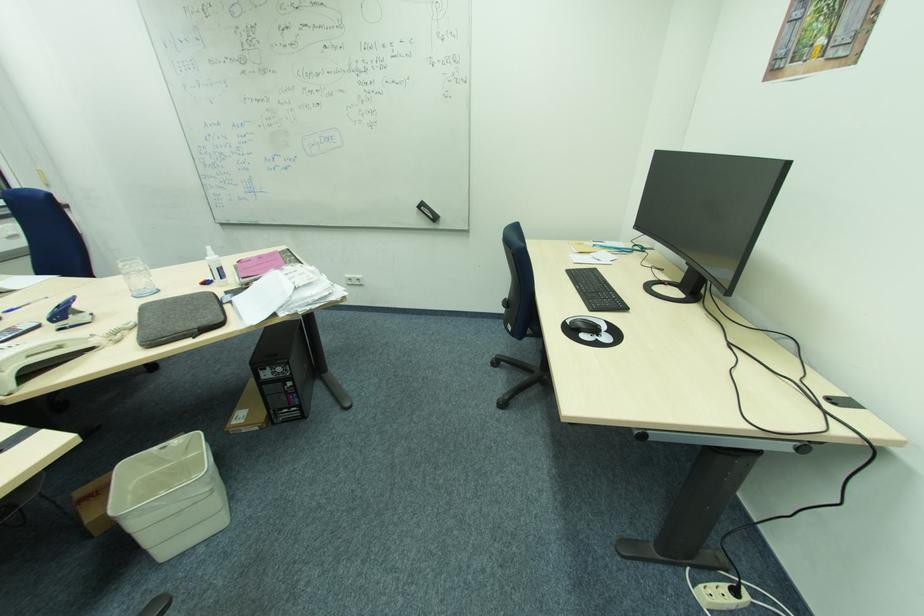
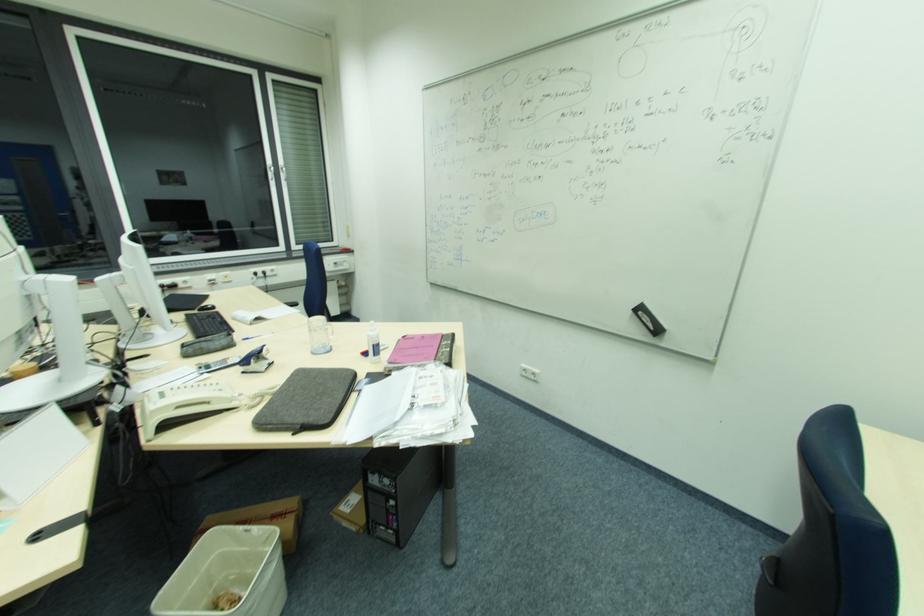
In the second image, find the point that corresponds to [84,312] in the first image.

(269, 359)